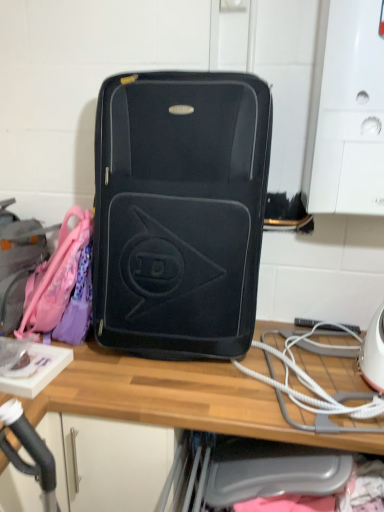
Question: Does matte black suitcase at center appear on the right side of matte pink backpack at left?

Choices:
 (A) no
 (B) yes

Answer: (B)

Question: Does matte black suitcase at center contain matte pink backpack at left?

Choices:
 (A) no
 (B) yes

Answer: (A)

Question: Can we say matte black suitcase at center lies outside matte pink backpack at left?

Choices:
 (A) no
 (B) yes

Answer: (B)

Question: From a real-world perspective, is matte black suitcase at center physically above matte pink backpack at left?

Choices:
 (A) no
 (B) yes

Answer: (B)

Question: Does matte black suitcase at center have a larger size compared to matte pink backpack at left?

Choices:
 (A) yes
 (B) no

Answer: (A)

Question: Is white cord at lower right in front of or behind matte pink backpack at left in the image?

Choices:
 (A) behind
 (B) front

Answer: (B)

Question: From a real-world perspective, is white cord at lower right positioned above or below matte pink backpack at left?

Choices:
 (A) above
 (B) below

Answer: (B)

Question: Is white cord at lower right wider or thinner than matte pink backpack at left?

Choices:
 (A) thin
 (B) wide

Answer: (B)

Question: From the image's perspective, relative to matte pink backpack at left, is white cord at lower right above or below?

Choices:
 (A) below
 (B) above

Answer: (A)

Question: Considering the positions of matte black suitcase at center and matte pink backpack at left in the image, is matte black suitcase at center wider or thinner than matte pink backpack at left?

Choices:
 (A) wide
 (B) thin

Answer: (A)

Question: Based on their positions, is matte black suitcase at center located to the left or right of matte pink backpack at left?

Choices:
 (A) right
 (B) left

Answer: (A)

Question: Does point (147, 247) appear closer or farther from the camera than point (26, 221)?

Choices:
 (A) farther
 (B) closer

Answer: (B)

Question: Is matte black suitcase at center taller or shorter than matte pink backpack at left?

Choices:
 (A) short
 (B) tall

Answer: (B)

Question: Considering the positions of point (266, 381) and point (64, 458), is point (266, 381) closer or farther from the camera than point (64, 458)?

Choices:
 (A) farther
 (B) closer

Answer: (B)

Question: In terms of size, does white cord at lower right appear bigger or smaller than wooden desk at center?

Choices:
 (A) small
 (B) big

Answer: (A)